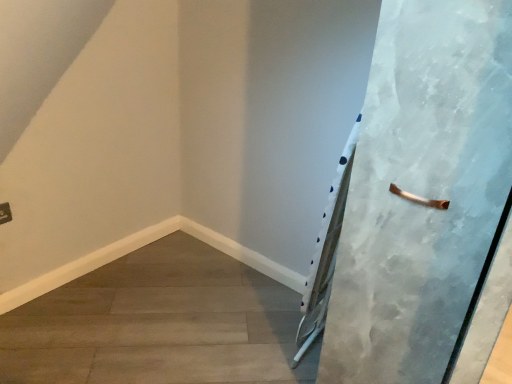
Question: Is textured white door at right wider or thinner than smooth concrete floor at lower left?

Choices:
 (A) thin
 (B) wide

Answer: (A)

Question: Is textured white door at right inside the boundaries of smooth concrete floor at lower left, or outside?

Choices:
 (A) outside
 (B) inside

Answer: (A)

Question: Considering the positions of point (464, 110) and point (83, 365), is point (464, 110) closer or farther from the camera than point (83, 365)?

Choices:
 (A) farther
 (B) closer

Answer: (B)

Question: Considering the relative positions of smooth concrete floor at lower left and textured white door at right in the image provided, is smooth concrete floor at lower left to the left or to the right of textured white door at right?

Choices:
 (A) right
 (B) left

Answer: (B)

Question: From the image's perspective, is smooth concrete floor at lower left above or below textured white door at right?

Choices:
 (A) below
 (B) above

Answer: (A)

Question: Is point (189, 274) closer or farther from the camera than point (404, 382)?

Choices:
 (A) closer
 (B) farther

Answer: (B)

Question: From their relative heights in the image, would you say smooth concrete floor at lower left is taller or shorter than textured white door at right?

Choices:
 (A) tall
 (B) short

Answer: (B)